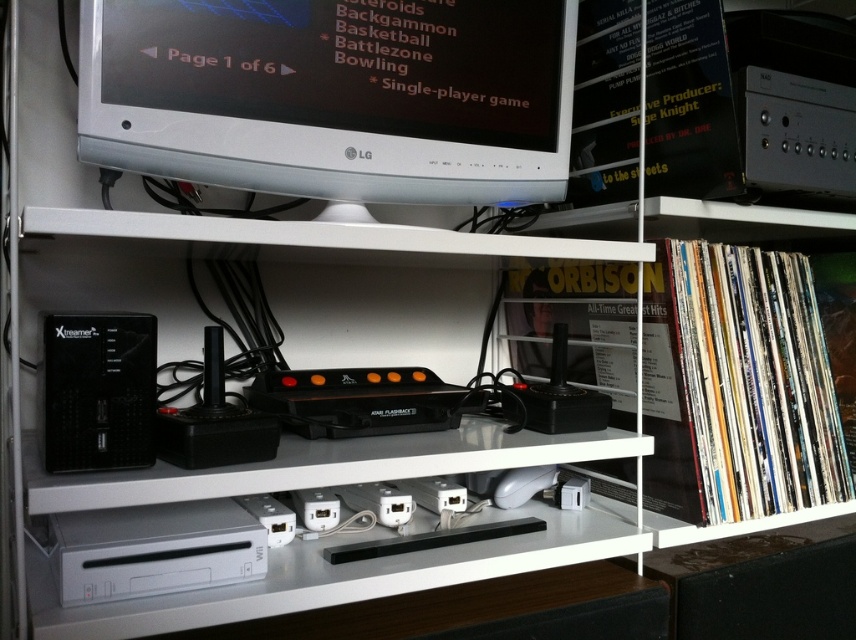
Who is lower down, white glossy computer monitor at upper center or black plastic speaker at left?

black plastic speaker at left is lower down.

Image resolution: width=856 pixels, height=640 pixels. What do you see at coordinates (333, 96) in the screenshot?
I see `white glossy computer monitor at upper center` at bounding box center [333, 96].

The height and width of the screenshot is (640, 856). Identify the location of white glossy computer monitor at upper center. (333, 96).